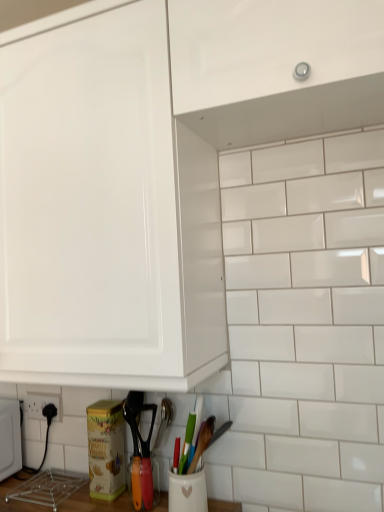
This screenshot has width=384, height=512. In order to click on glossy white cabinet at upper center in this screenshot , I will do `click(268, 47)`.

Does glossy white cabinet at upper center turn towards wooden spatula at lower center?

No.

Can you tell me how much glossy white cabinet at upper center and wooden spatula at lower center differ in facing direction?

The facing directions of glossy white cabinet at upper center and wooden spatula at lower center are 0.103 degrees apart.

From the image's perspective, relative to wooden spatula at lower center, is glossy white cabinet at upper center above or below?

glossy white cabinet at upper center is situated higher than wooden spatula at lower center in the image.

Identify the location of cabinetry positioned vertically above the wooden spatula at lower center (from a real-world perspective). (268, 47).

Which is more to the right, black plastic electric outlet at lower left or glossy white cabinet at upper center?

glossy white cabinet at upper center is more to the right.

From the image's perspective, which is above, black plastic electric outlet at lower left or glossy white cabinet at upper center?

glossy white cabinet at upper center appears higher in the image.

At what (x,y) coordinates should I click in order to perform the action: click on cabinetry on the right of black plastic electric outlet at lower left. Please return your answer as a coordinate pair (x, y). Looking at the image, I should click on (268, 47).

How many degrees apart are the facing directions of black plastic electric outlet at lower left and glossy white cabinet at upper center?

black plastic electric outlet at lower left and glossy white cabinet at upper center are facing 0.102 degrees away from each other.

Is wooden spatula at lower center taller or shorter than black plastic electric outlet at lower left?

Clearly, wooden spatula at lower center is taller compared to black plastic electric outlet at lower left.

Could you tell me if wooden spatula at lower center is turned towards black plastic electric outlet at lower left?

No, wooden spatula at lower center does not turn towards black plastic electric outlet at lower left.

Which object is positioned more to the right, wooden spatula at lower center or black plastic electric outlet at lower left?

From the viewer's perspective, wooden spatula at lower center appears more on the right side.

Is glossy white cabinet at upper center far from black plastic electric outlet at lower left?

Yes, glossy white cabinet at upper center and black plastic electric outlet at lower left are quite far apart.

Find the location of a particular element. The image size is (384, 512). cabinetry that appears above the black plastic electric outlet at lower left (from a real-world perspective) is located at coordinates (268, 47).

Is glossy white cabinet at upper center oriented away from black plastic electric outlet at lower left?

glossy white cabinet at upper center is not turned away from black plastic electric outlet at lower left.

Is glossy white cabinet at upper center wider than black plastic electric outlet at lower left?

Yes.

Locate an element on the screen. This screenshot has width=384, height=512. electric outlet on the left of the wooden spatula at lower center is located at coordinates coord(42,404).

How different are the orientations of black plastic electric outlet at lower left and wooden spatula at lower center in degrees?

0.00366 degrees.

Is black plastic electric outlet at lower left positioned behind wooden spatula at lower center?

That is True.

From the image's perspective, which is above, wooden spatula at lower center or glossy white cabinet at upper center?

glossy white cabinet at upper center.

Is wooden spatula at lower center thinner than glossy white cabinet at upper center?

Yes.

Is the surface of wooden spatula at lower center in direct contact with glossy white cabinet at upper center?

There is a gap between wooden spatula at lower center and glossy white cabinet at upper center.

What are the coordinates of `appliance that appears behind the glossy white cabinet at upper center` in the screenshot? It's located at (143, 482).

Identify the location of cabinetry that appears above the black plastic electric outlet at lower left (from a real-world perspective). (268, 47).

Looking at the image, which one is located closer to black plastic electric outlet at lower left, glossy white cabinet at upper center or wooden spatula at lower center?

The object closer to black plastic electric outlet at lower left is wooden spatula at lower center.

When comparing their distances from wooden spatula at lower center, does glossy white cabinet at upper center or black plastic electric outlet at lower left seem further?

Based on the image, glossy white cabinet at upper center appears to be further to wooden spatula at lower center.

Looking at the image, which one is located closer to wooden spatula at lower center, black plastic electric outlet at lower left or glossy white cabinet at upper center?

black plastic electric outlet at lower left.

Considering their positions, is black plastic electric outlet at lower left positioned further to glossy white cabinet at upper center than wooden spatula at lower center?

Among the two, black plastic electric outlet at lower left is located further to glossy white cabinet at upper center.

Considering their positions, is wooden spatula at lower center positioned further to black plastic electric outlet at lower left than glossy white cabinet at upper center?

glossy white cabinet at upper center.

Looking at the image, which one is located closer to glossy white cabinet at upper center, wooden spatula at lower center or black plastic electric outlet at lower left?

wooden spatula at lower center is closer to glossy white cabinet at upper center.

The height and width of the screenshot is (512, 384). I want to click on electric outlet between glossy white cabinet at upper center and wooden spatula at lower center in the up-down direction, so click(x=42, y=404).